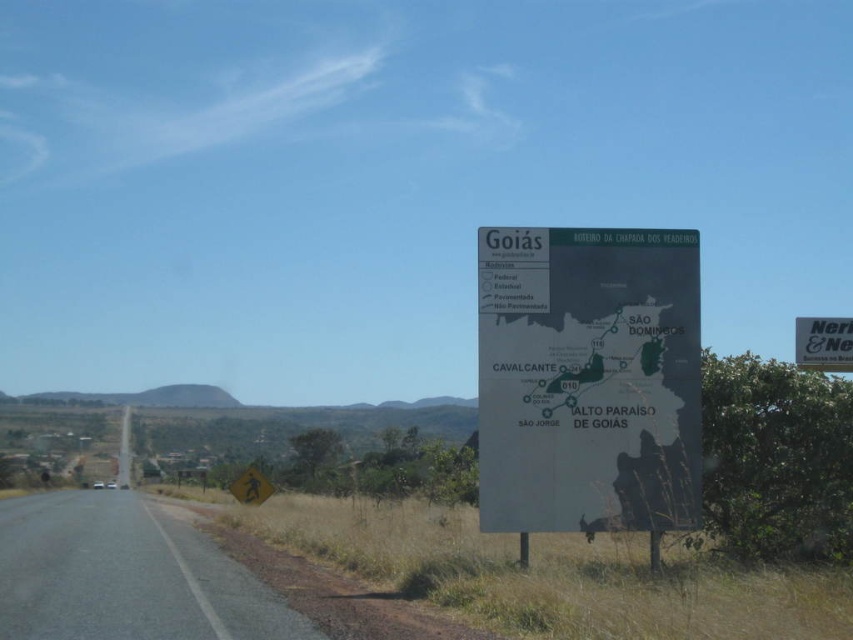
Does matte black map at right appear over gray asphalt road at lower left?

Indeed, matte black map at right is positioned over gray asphalt road at lower left.

Measure the distance between matte black map at right and gray asphalt road at lower left.

matte black map at right and gray asphalt road at lower left are 5.73 meters apart.

The height and width of the screenshot is (640, 853). I want to click on matte black map at right, so pos(589,378).

Can you confirm if gray asphalt road at lower left is positioned below white plastic sign at right?

Indeed, gray asphalt road at lower left is positioned under white plastic sign at right.

Is gray asphalt road at lower left shorter than white plastic sign at right?

No, gray asphalt road at lower left is not shorter than white plastic sign at right.

Between point (9, 499) and point (808, 324), which one is positioned behind?

The point (9, 499) is behind.

You are a GUI agent. You are given a task and a screenshot of the screen. Output one action in this format:
    pyautogui.click(x=<x>, y=<y>)
    Task: Click on the gray asphalt road at lower left
    The image size is (853, 640).
    Given the screenshot: What is the action you would take?
    pyautogui.click(x=126, y=573)

Which is above, matte black map at right or white plastic sign at right?

white plastic sign at right is higher up.

In the scene shown: Is matte black map at right below white plastic sign at right?

Correct, matte black map at right is located below white plastic sign at right.

Between point (691, 401) and point (838, 348), which one is positioned behind?

Positioned behind is point (838, 348).

Locate an element on the screen. matte black map at right is located at coordinates (589, 378).